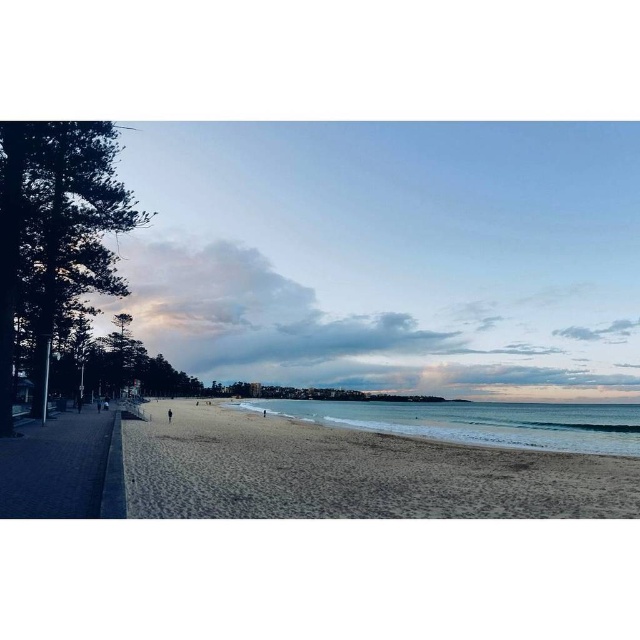
You are standing on the beige sandy beach at center and want to reach the blue water at lower center. Which direction should you move to get there?

Since the beige sandy beach at center is closer to the viewer than the blue water at lower center, you should move forward away from the viewer to reach the blue water at lower center.

You are standing on the beige sandy beach at center and want to reach the blue water at lower center. Which direction should you walk to get there?

You should walk downward towards the blue water at lower center since the beige sandy beach at center is located above it.

Looking at this image, you are standing on the beach and see two points marked in the image. Which point, point (353, 449) or point (420, 435), is closer to you?

Point (353, 449) is closer to the viewer than point (420, 435).